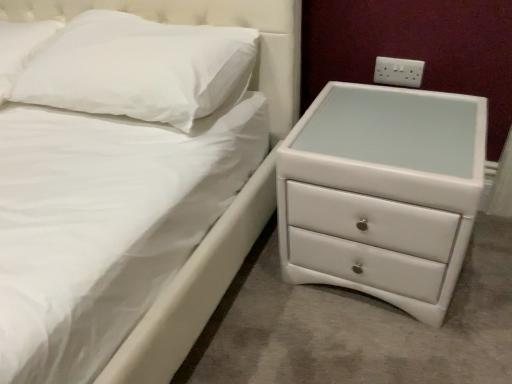
Question: From a real-world perspective, is white plastic electrical outlet at upper right above or below white glossy chest of drawers at right?

Choices:
 (A) below
 (B) above

Answer: (B)

Question: Looking at the image, does white plastic electrical outlet at upper right seem bigger or smaller compared to white glossy chest of drawers at right?

Choices:
 (A) big
 (B) small

Answer: (B)

Question: Estimate the real-world distances between objects in this image. Which object is farther from the white matte pillow at upper left, which is counted as the 1th pillow, starting from the left?

Choices:
 (A) white glossy chest of drawers at right
 (B) white plastic electrical outlet at upper right
 (C) white soft pillow at upper left, which is the first pillow in right-to-left order

Answer: (B)

Question: Based on their relative distances, which object is nearer to the white soft pillow at upper left, marked as the second pillow in a left-to-right arrangement?

Choices:
 (A) white plastic electrical outlet at upper right
 (B) white glossy chest of drawers at right
 (C) white matte pillow at upper left, which is counted as the 1th pillow, starting from the left

Answer: (C)